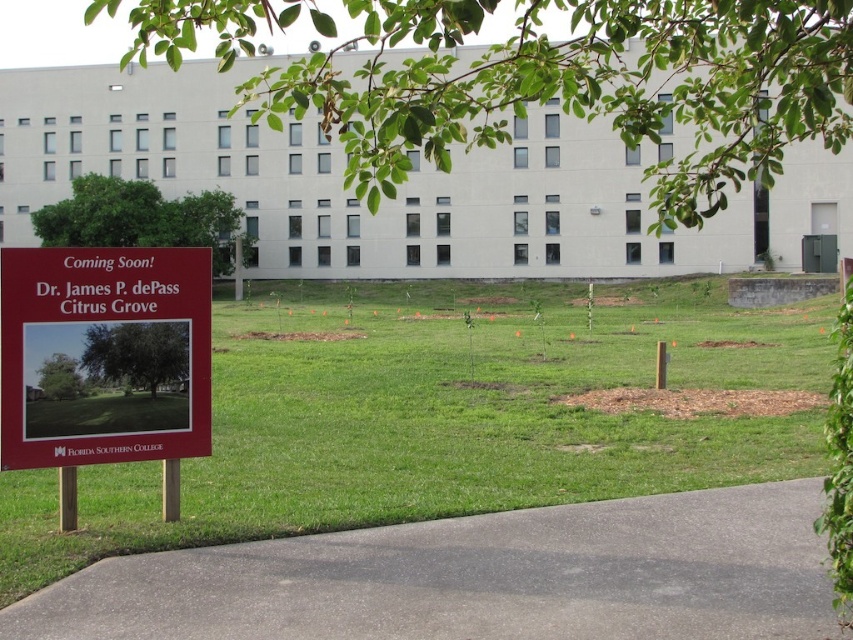
Does gray asphalt path at lower center lie in front of red matte sign at lower left?

Yes, it is in front of red matte sign at lower left.

Which of these two, gray asphalt path at lower center or red matte sign at lower left, stands shorter?

Standing shorter between the two is gray asphalt path at lower center.

Between point (517, 554) and point (12, 316), which one is positioned in front?

Positioned in front is point (517, 554).

This screenshot has height=640, width=853. Identify the location of gray asphalt path at lower center. (479, 579).